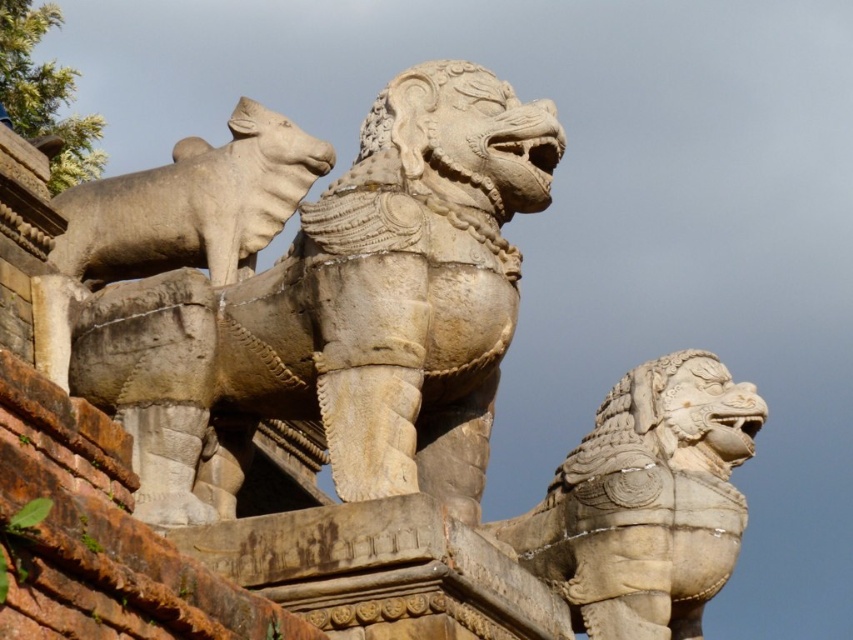
You are an architect examining the stone lion at center and the gray stone bull at upper left. Which statue is placed higher up in the structure?

The gray stone bull at upper left is placed higher up in the structure than the stone lion at center.

Looking at this image, you are an art conservator examining the stone statues in the image. You need to determine the spatial arrangement of the stone lion at center and the stone lion at right. Which lion is positioned further to the left side of the structure?

Result: The stone lion at center is positioned further to the left side of the structure compared to the stone lion at right.